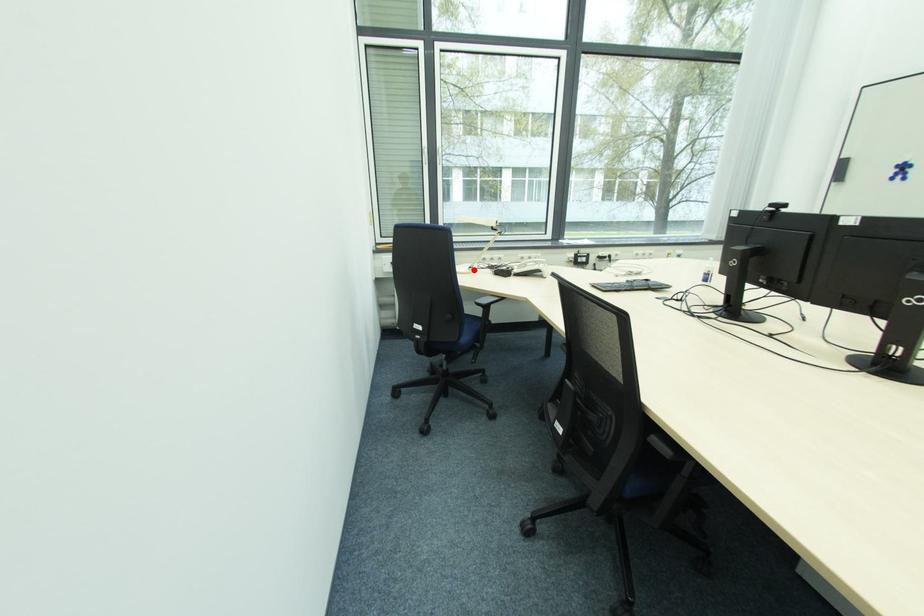
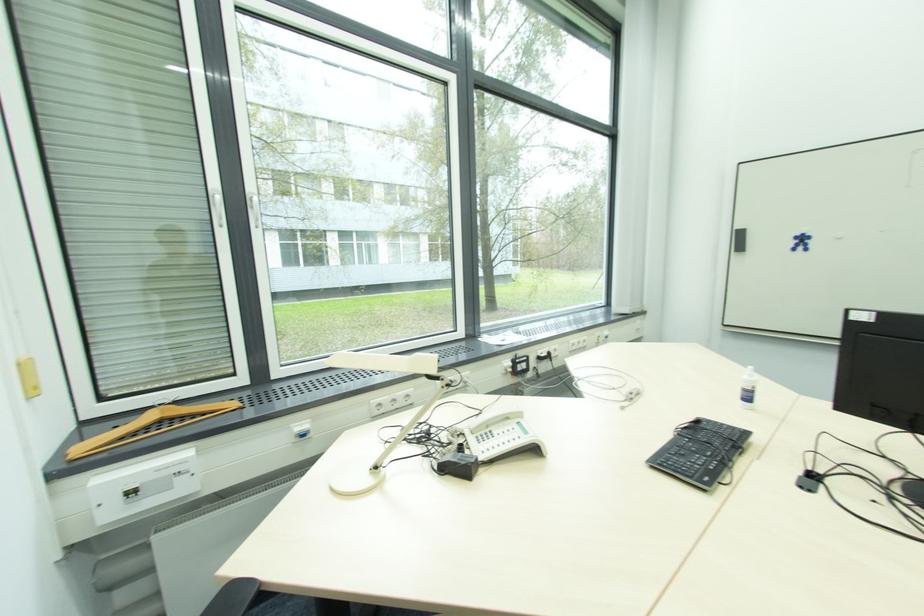
Locate, in the second image, the point that corresponds to the highlighted location in the first image.

(380, 469)